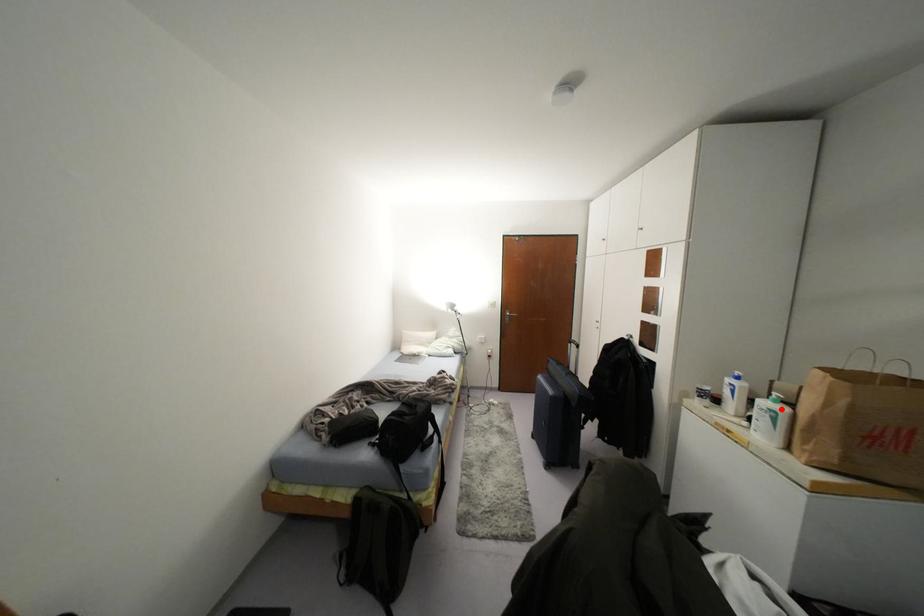
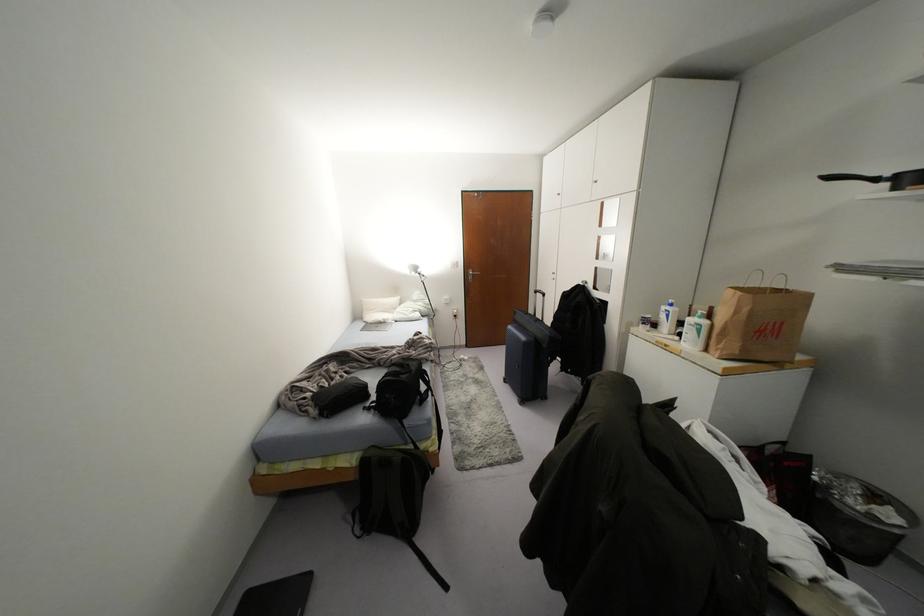
Find the pixel in the second image that matches the highlighted location in the first image.

(703, 322)